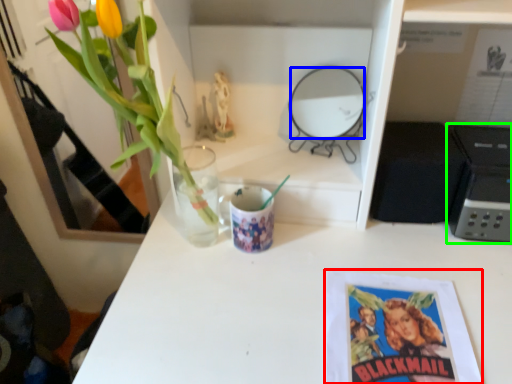
Question: Which object is positioned farthest from book cover (highlighted by a red box)? Select from mirror (highlighted by a blue box) and appliance (highlighted by a green box).

Choices:
 (A) mirror
 (B) appliance

Answer: (A)